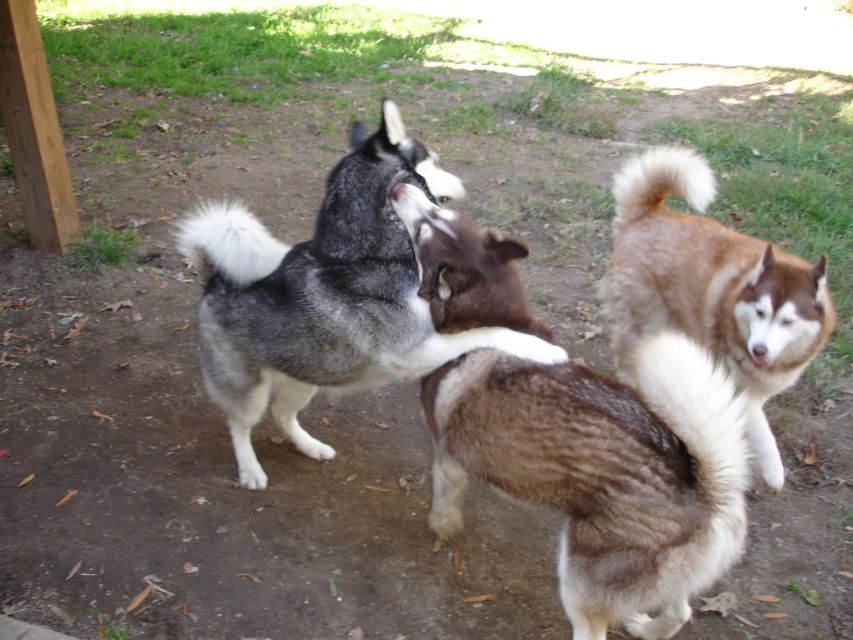
You are a dog owner who wants to ensure your pets are comfortable in the autumn weather. Looking at the image, which dog has a thicker coat between the brown fur at center and the gray and white fur husky at center?

The gray and white fur husky at center has a thicker coat than the brown fur at center.

You are a dog trainer observing the scene. You need to place a treat between the brown fur at center and the brown fuzzy dog at right. Can you fit the treat in the space between them if the treat is 2 inches wide?

The distance between the brown fur at center and the brown fuzzy dog at right is 32.00 inches, which is more than enough space to place a 2 inch wide treat between them.